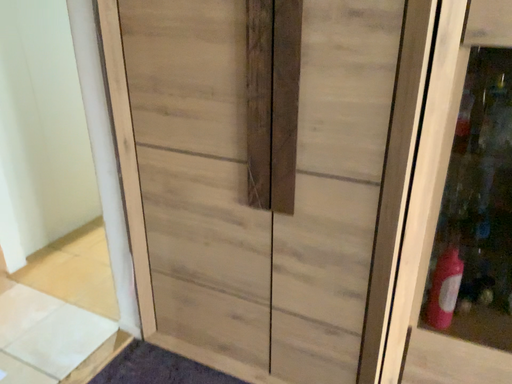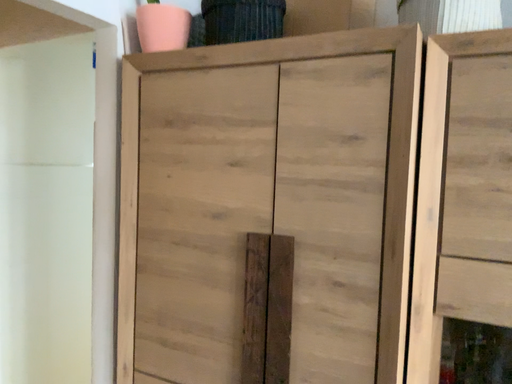
Question: How did the camera likely rotate when shooting the video?

Choices:
 (A) rotated upward
 (B) rotated downward

Answer: (A)